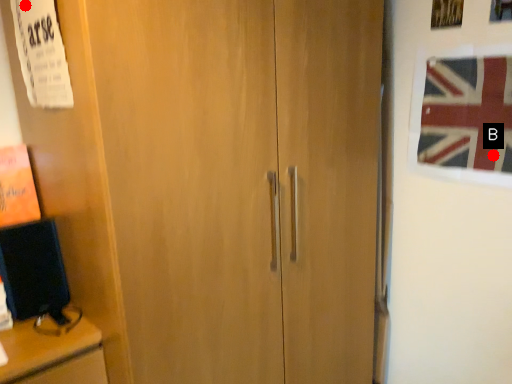
Question: Two points are circled on the image, labeled by A and B beside each circle. Which of the following is the closest to the observer?

Choices:
 (A) A is closer
 (B) B is closer

Answer: (A)